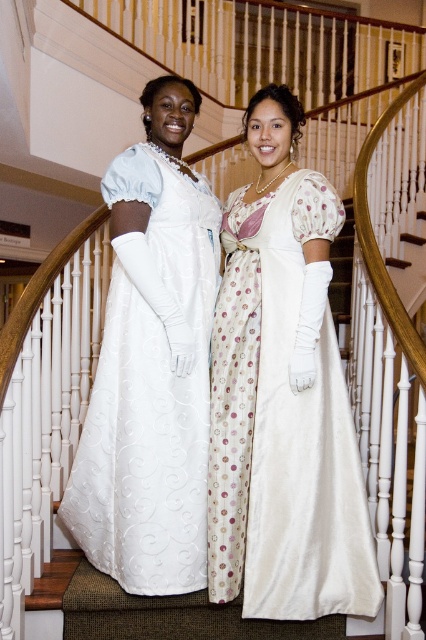
In the scene shown: Does silky white gown at center appear on the right side of white satin dress at center?

Correct, you'll find silky white gown at center to the right of white satin dress at center.

Between silky white gown at center and white satin dress at center, which one is positioned higher?

white satin dress at center

In order to click on silky white gown at center in this screenshot , I will do `click(282, 426)`.